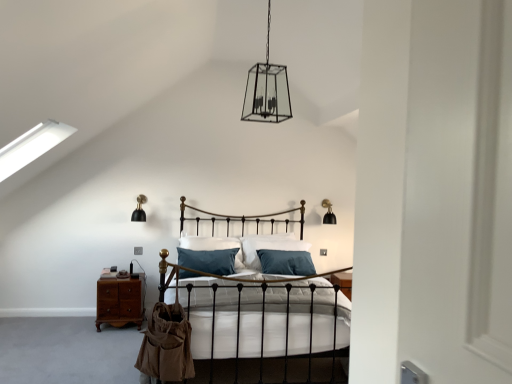
This screenshot has width=512, height=384. Find the location of `free space on the front side of mahogany wood nightstand at lower left`. free space on the front side of mahogany wood nightstand at lower left is located at coordinates click(98, 332).